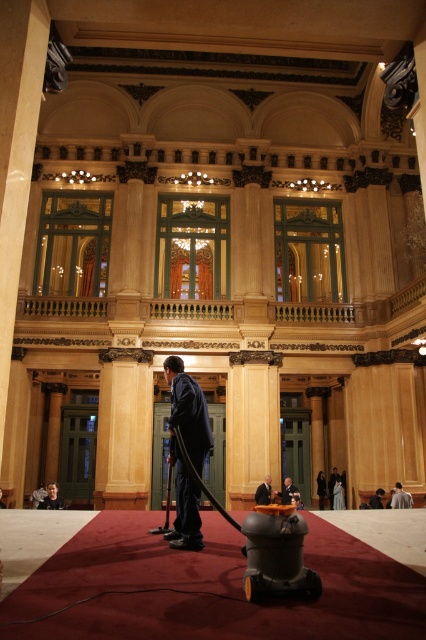
You are a stagehand standing at the camera position. You need to place a prop that is 130 feet long on the stage. Can you fit the prop along the direction from the camera to the dark blue suit at center?

The dark blue suit at center is 128.39 feet from the camera. Since the prop is 130 feet long, it cannot be placed along that direction as the available space is shorter than the prop.

You are a stagehand preparing for a performance. You need to determine which of the two items at center stage is the actual costume for the lead actor. The items are the dark blue suit at center and the dark blue fabric suit at center. Based on their height, which one is more likely to be the costume?

The dark blue suit at center is more likely to be the actual costume since it has a greater height compared to the dark blue fabric suit at center, indicating it is a wearable garment rather than a flat fabric piece.

You are a stagehand preparing for a performance. You need to place both the dark gray suit at center and the dark blue fabric suit at center on a storage rack that can only hold one of them. Which suit should you choose based on their sizes?

The dark gray suit at center has a larger size compared to the dark blue fabric suit at center, so you should choose the dark gray suit at center to place on the storage rack since it requires more space.